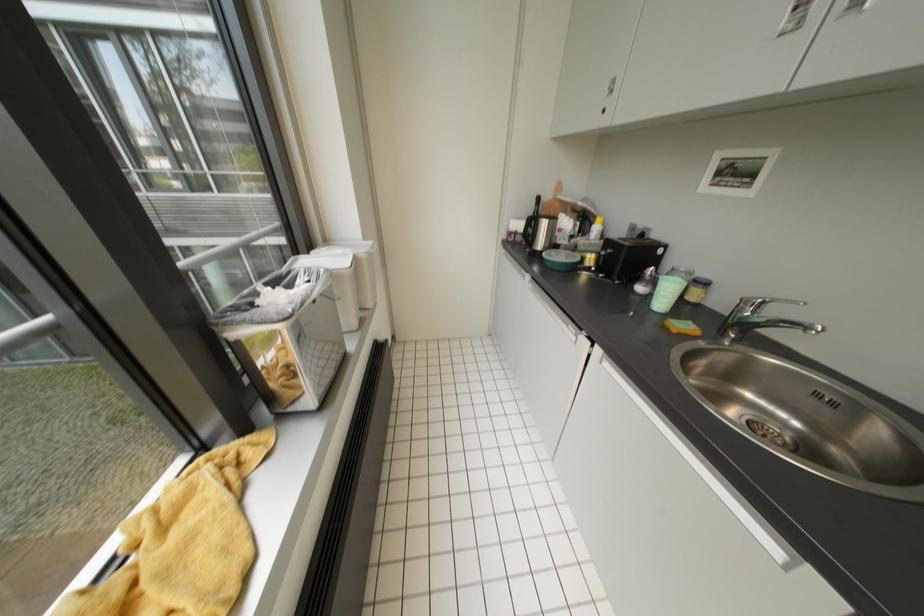
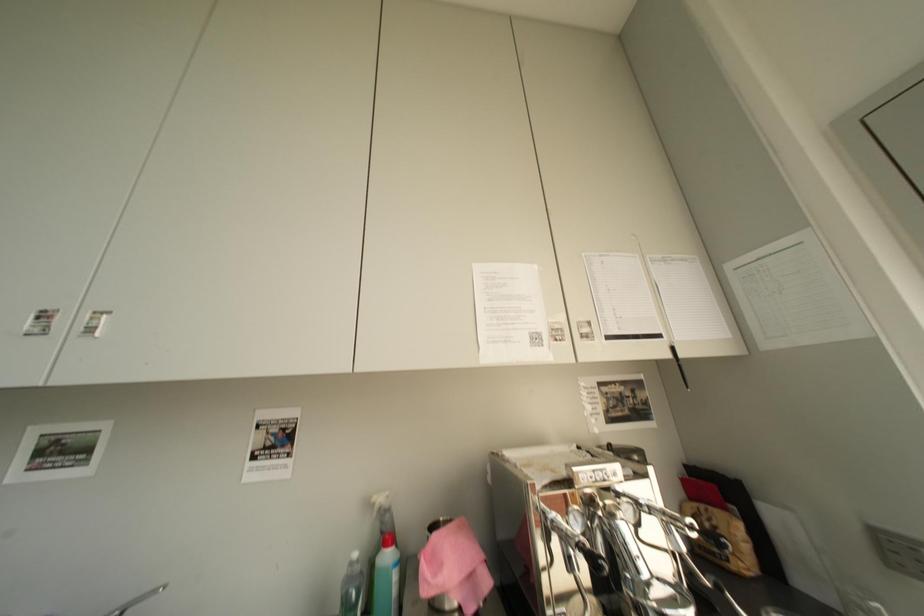
Question: The camera is either moving clockwise (left) or counter-clockwise (right) around the object. The first image is from the beginning of the video and the second image is from the end. Is the camera moving left or right when shooting the video?

Choices:
 (A) Left
 (B) Right

Answer: (A)